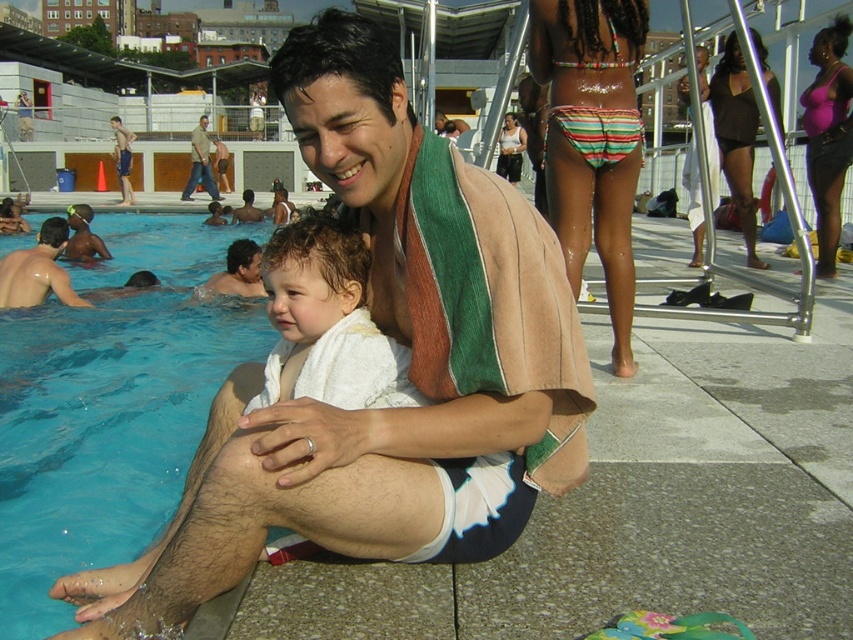
Question: Which of the following is the closest to the observer?

Choices:
 (A) (378, 403)
 (B) (192, 134)

Answer: (A)

Question: Can you confirm if blue smooth water at lower left is wider than khaki cotton pants at center?

Choices:
 (A) no
 (B) yes

Answer: (B)

Question: Is beige towel at center positioned before shiny wet skin at left?

Choices:
 (A) yes
 (B) no

Answer: (A)

Question: Which point is closer to the camera taking this photo?

Choices:
 (A) (409, 404)
 (B) (213, 196)
 (C) (136, 333)
 (D) (9, 298)

Answer: (A)

Question: Which of these objects is positioned farthest from the white towel at center?

Choices:
 (A) shiny wet skin at left
 (B) khaki cotton pants at center
 (C) beige towel at center
 (D) blue smooth water at lower left

Answer: (B)

Question: Is blue smooth water at lower left above khaki cotton pants at center?

Choices:
 (A) no
 (B) yes

Answer: (A)